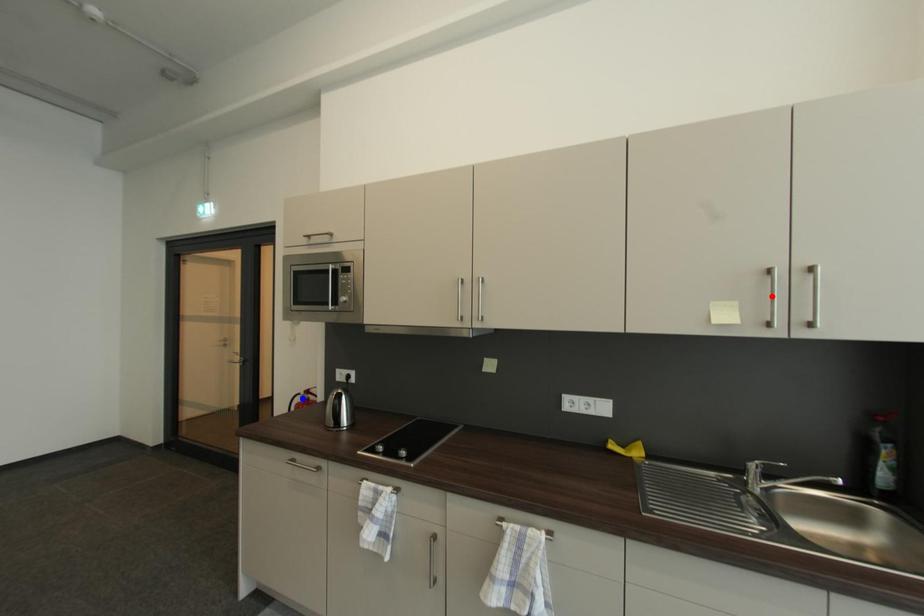
Question: Two points are marked on the image. Which point is closer to the camera?

Choices:
 (A) Blue point is closer.
 (B) Red point is closer.

Answer: (B)